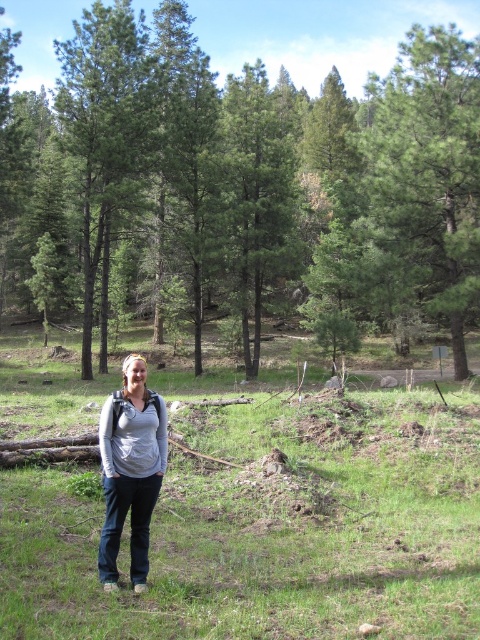
Between green matte trees at center and gray matte shirt at center, which one appears on the left side from the viewer's perspective?

From the viewer's perspective, green matte trees at center appears more on the left side.

Describe the element at coordinates (273, 172) in the screenshot. I see `green matte trees at center` at that location.

This screenshot has height=640, width=480. In order to click on green matte trees at center in this screenshot , I will do `click(273, 172)`.

Can you confirm if green matte trees at center is taller than green matte tree at center?

Indeed, green matte trees at center has a greater height compared to green matte tree at center.

Between green matte trees at center and green matte tree at center, which one appears on the left side from the viewer's perspective?

From the viewer's perspective, green matte trees at center appears more on the left side.

What do you see at coordinates (273, 172) in the screenshot? This screenshot has width=480, height=640. I see `green matte trees at center` at bounding box center [273, 172].

You are a GUI agent. You are given a task and a screenshot of the screen. Output one action in this format:
    pyautogui.click(x=<x>, y=<y>)
    Task: Click on the green matte trees at center
    The height and width of the screenshot is (640, 480).
    Given the screenshot: What is the action you would take?
    pyautogui.click(x=273, y=172)

Which is behind, point (408, 109) or point (254, 268)?

The point (254, 268) is more distant.

Can you confirm if green matte tree at upper right is smaller than green matte tree at center?

Actually, green matte tree at upper right might be larger than green matte tree at center.

Measure the distance between point (436, 28) and camera.

The distance of point (436, 28) from camera is 21.75 meters.

Where is `green matte tree at upper right`? green matte tree at upper right is located at coordinates (428, 173).